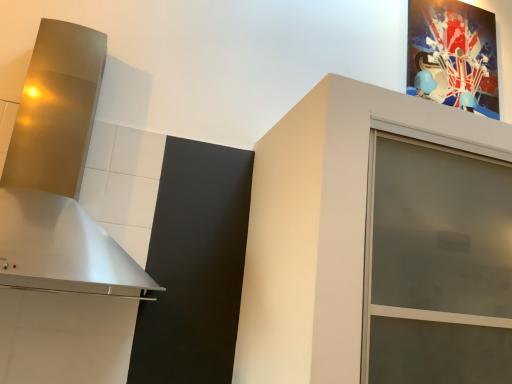
You are a GUI agent. You are given a task and a screenshot of the screen. Output one action in this format:
    pyautogui.click(x=<x>, y=<y>)
    Task: Click on the frosted glass cabinet at upper right
    Image resolution: width=512 pixels, height=384 pixels.
    Given the screenshot: What is the action you would take?
    pyautogui.click(x=320, y=229)

At what (x,y) coordinates should I click in order to perform the action: click on metallic glossy picture frame at upper right. Please return your answer as a coordinate pair (x, y). Looking at the image, I should click on (454, 53).

How different are the orientations of metallic glossy picture frame at upper right and metallic silver vent at left in degrees?

metallic glossy picture frame at upper right and metallic silver vent at left are facing 0.393 degrees away from each other.

From the image's perspective, does metallic glossy picture frame at upper right appear higher than metallic silver vent at left?

Indeed, from the image's perspective, metallic glossy picture frame at upper right is shown above metallic silver vent at left.

Can we say metallic glossy picture frame at upper right lies outside metallic silver vent at left?

metallic glossy picture frame at upper right is positioned outside metallic silver vent at left.

Between metallic glossy picture frame at upper right and metallic silver vent at left, which one has larger size?

metallic silver vent at left.

From the image's perspective, is frosted glass cabinet at upper right positioned above or below metallic silver vent at left?

frosted glass cabinet at upper right is below metallic silver vent at left.

From a real-world perspective, which object stands above the other?

metallic silver vent at left, from a real-world perspective.

Considering the positions of point (342, 249) and point (14, 194), is point (342, 249) closer or farther from the camera than point (14, 194)?

Point (342, 249).

At what (x,y) coordinates should I click in order to perform the action: click on vent lying on the left of frosted glass cabinet at upper right. Please return your answer as a coordinate pair (x, y). Image resolution: width=512 pixels, height=384 pixels. Looking at the image, I should click on (59, 176).

Which of these two, metallic silver vent at left or frosted glass cabinet at upper right, is bigger?

With larger size is frosted glass cabinet at upper right.

Is metallic silver vent at left oriented away from frosted glass cabinet at upper right?

No, metallic silver vent at left is not facing the opposite direction of frosted glass cabinet at upper right.

Do you think metallic silver vent at left is within frosted glass cabinet at upper right, or outside of it?

metallic silver vent at left is outside frosted glass cabinet at upper right.

Looking at this image, is metallic silver vent at left shorter than metallic glossy picture frame at upper right?

Incorrect, the height of metallic silver vent at left does not fall short of that of metallic glossy picture frame at upper right.

Is point (42, 164) in front of point (449, 63)?

Yes.

Identify the location of vent below the metallic glossy picture frame at upper right (from a real-world perspective). Image resolution: width=512 pixels, height=384 pixels. (59, 176).

From a real-world perspective, is frosted glass cabinet at upper right physically located above or below metallic glossy picture frame at upper right?

frosted glass cabinet at upper right is below metallic glossy picture frame at upper right.

Would you say frosted glass cabinet at upper right is to the left or to the right of metallic glossy picture frame at upper right in the picture?

frosted glass cabinet at upper right is to the left of metallic glossy picture frame at upper right.

Is point (273, 262) farther from camera compared to point (414, 57)?

No, (273, 262) is closer to viewer.

Is frosted glass cabinet at upper right facing towards metallic glossy picture frame at upper right?

No, frosted glass cabinet at upper right does not turn towards metallic glossy picture frame at upper right.

Does metallic glossy picture frame at upper right have a lesser height compared to frosted glass cabinet at upper right?

Yes, metallic glossy picture frame at upper right is shorter than frosted glass cabinet at upper right.

From the image's perspective, is metallic glossy picture frame at upper right positioned above or below frosted glass cabinet at upper right?

Based on their image positions, metallic glossy picture frame at upper right is located above frosted glass cabinet at upper right.

Considering the positions of point (489, 97) and point (258, 236), is point (489, 97) closer or farther from the camera than point (258, 236)?

Point (489, 97) is farther from the camera than point (258, 236).

Is metallic glossy picture frame at upper right to the left of frosted glass cabinet at upper right from the viewer's perspective?

Incorrect, metallic glossy picture frame at upper right is not on the left side of frosted glass cabinet at upper right.

You are a GUI agent. You are given a task and a screenshot of the screen. Output one action in this format:
    pyautogui.click(x=<x>, y=<y>)
    Task: Click on the picture frame located on the right of metallic silver vent at left
    The height and width of the screenshot is (384, 512).
    Given the screenshot: What is the action you would take?
    pyautogui.click(x=454, y=53)

Locate an element on the screen. cabinetry below the metallic silver vent at left (from a real-world perspective) is located at coordinates pos(320,229).

Estimate the real-world distances between objects in this image. Which object is closer to metallic glossy picture frame at upper right, frosted glass cabinet at upper right or metallic silver vent at left?

Based on the image, frosted glass cabinet at upper right appears to be nearer to metallic glossy picture frame at upper right.

From the image, which object appears to be nearer to metallic glossy picture frame at upper right, metallic silver vent at left or frosted glass cabinet at upper right?

Based on the image, frosted glass cabinet at upper right appears to be nearer to metallic glossy picture frame at upper right.

Considering their positions, is metallic glossy picture frame at upper right positioned closer to metallic silver vent at left than frosted glass cabinet at upper right?

frosted glass cabinet at upper right is closer to metallic silver vent at left.

Considering their positions, is frosted glass cabinet at upper right positioned further to metallic silver vent at left than metallic glossy picture frame at upper right?

The object further to metallic silver vent at left is metallic glossy picture frame at upper right.

Based on their spatial positions, is metallic glossy picture frame at upper right or metallic silver vent at left closer to frosted glass cabinet at upper right?

Based on the image, metallic silver vent at left appears to be nearer to frosted glass cabinet at upper right.

Which object lies nearer to the anchor point frosted glass cabinet at upper right, metallic silver vent at left or metallic glossy picture frame at upper right?

metallic silver vent at left is positioned closer to the anchor frosted glass cabinet at upper right.

Locate an element on the screen. This screenshot has height=384, width=512. cabinetry situated between metallic silver vent at left and metallic glossy picture frame at upper right from left to right is located at coordinates (320, 229).